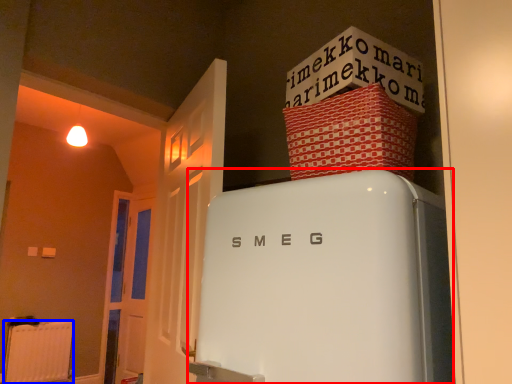
Question: Which of the following is the closest to the observer, refrigerator (highlighted by a red box) or radiator (highlighted by a blue box)?

Choices:
 (A) refrigerator
 (B) radiator

Answer: (A)